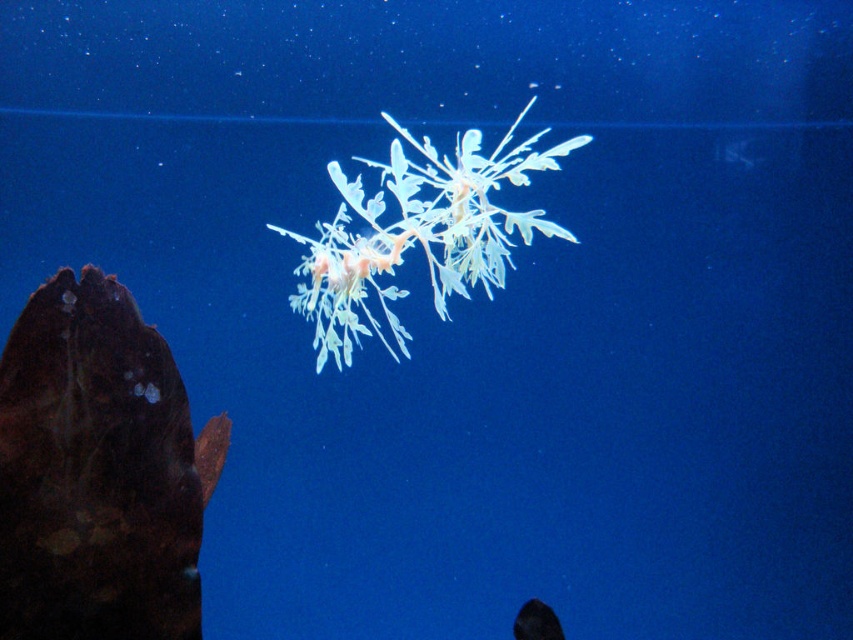
Between brown matte fish at left and translucent white leaf at center, which one is positioned higher?

Positioned higher is translucent white leaf at center.

Does brown matte fish at left appear over translucent white leaf at center?

Incorrect, brown matte fish at left is not positioned above translucent white leaf at center.

Locate an element on the screen. brown matte fish at left is located at coordinates (97, 472).